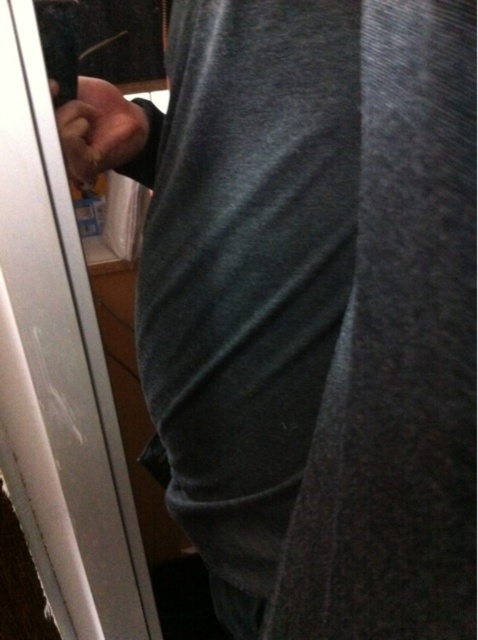
Based on the photo, does white glossy door at left have a larger size compared to smooth skin hand at upper left?

Correct, white glossy door at left is larger in size than smooth skin hand at upper left.

Is point (12, 16) farther from camera compared to point (97, 84)?

No, (12, 16) is in front of (97, 84).

Which is behind, point (6, 10) or point (104, 106)?

Positioned behind is point (104, 106).

You are a GUI agent. You are given a task and a screenshot of the screen. Output one action in this format:
    pyautogui.click(x=<x>, y=<y>)
    Task: Click on the white glossy door at left
    Image resolution: width=478 pixels, height=640 pixels.
    Given the screenshot: What is the action you would take?
    pyautogui.click(x=58, y=372)